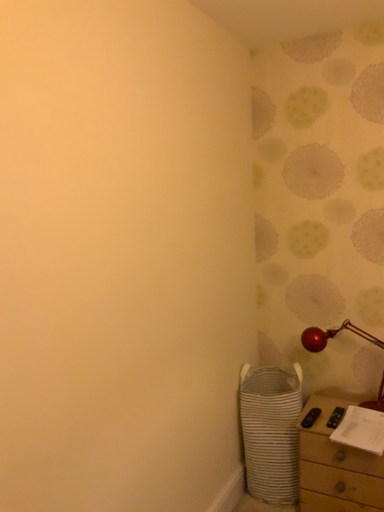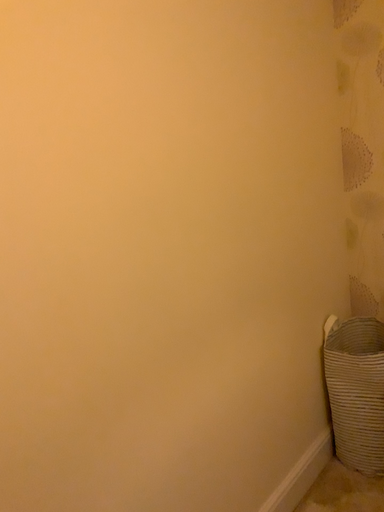
Question: Which way did the camera rotate in the video?

Choices:
 (A) rotated right
 (B) rotated left

Answer: (B)